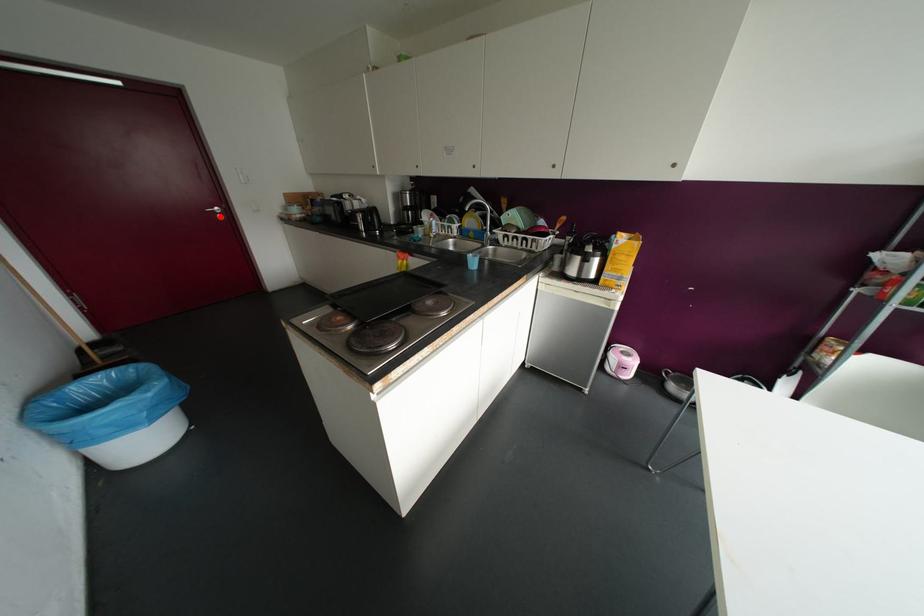
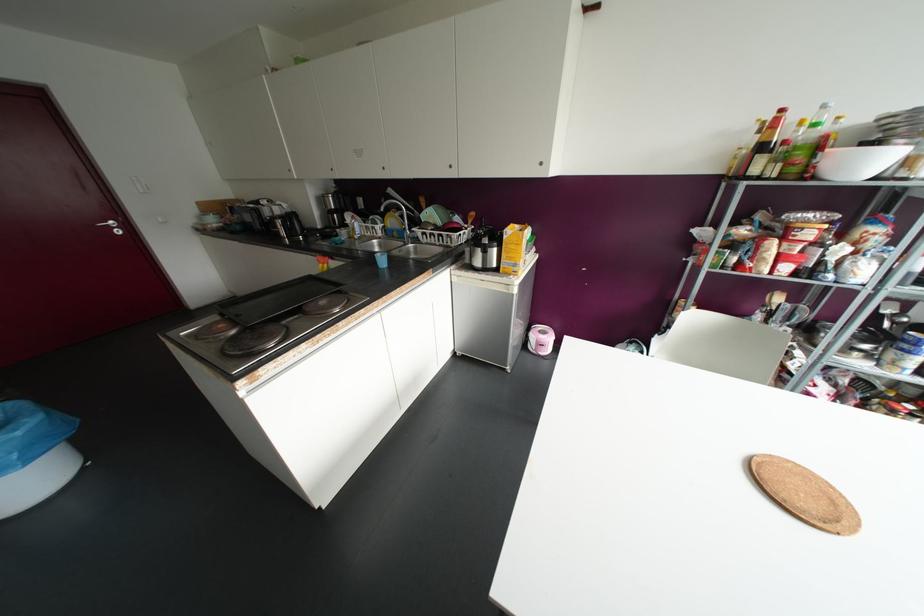
Question: I am providing you with two images of the same scene from different viewpoints. A red point is marked on the first image. Can you still see the location of the red point in image 2?

Choices:
 (A) Yes
 (B) No

Answer: (A)